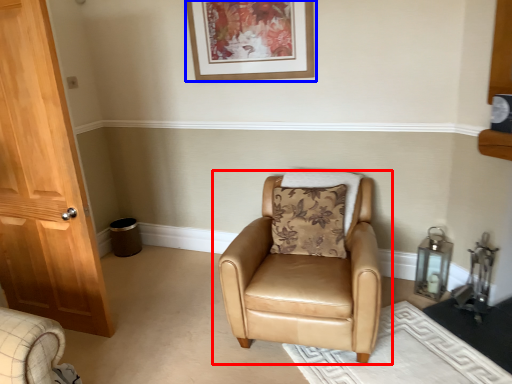
Question: Which of the following is the closest to the observer, chair (highlighted by a red box) or picture frame (highlighted by a blue box)?

Choices:
 (A) chair
 (B) picture frame

Answer: (A)